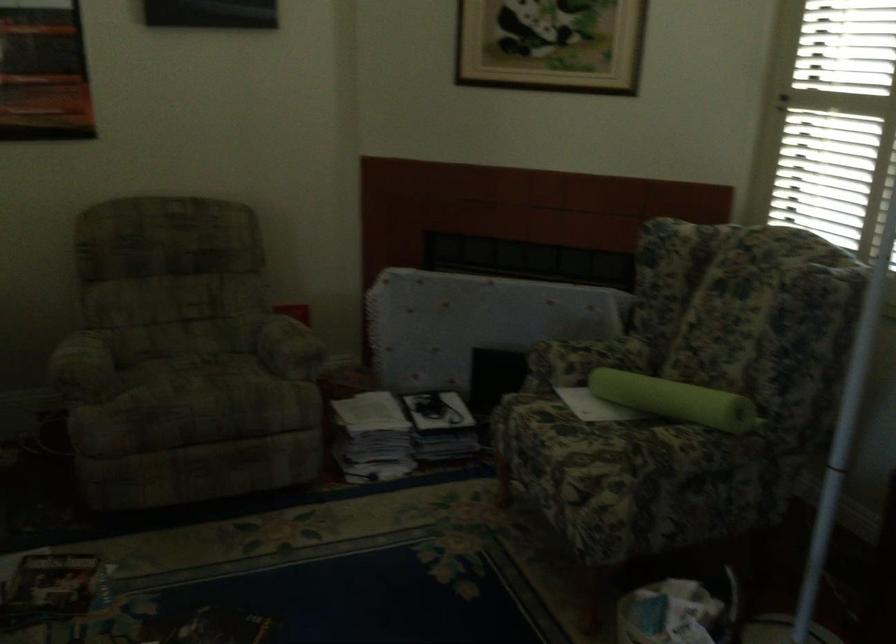
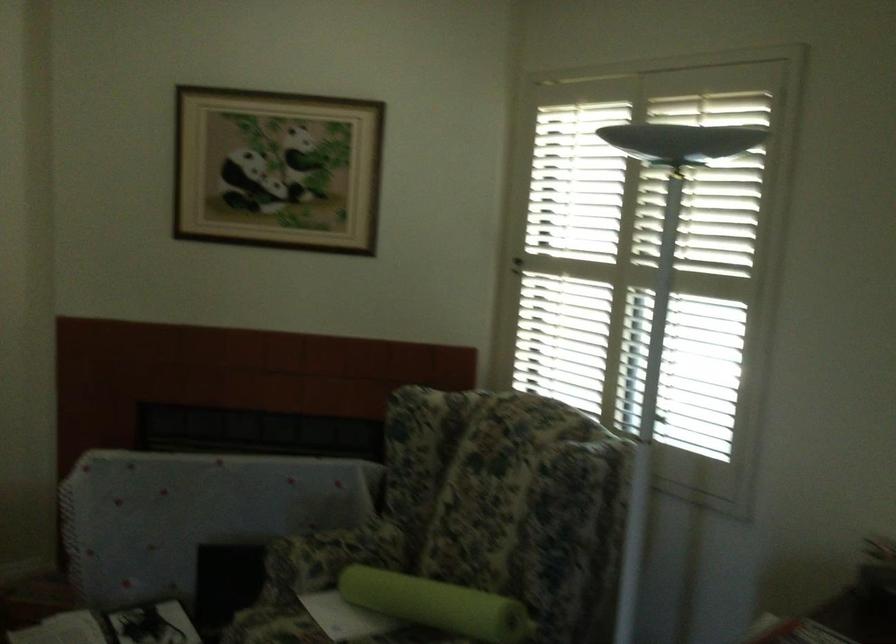
Question: In a continuous first-person perspective shot, in which direction is the camera moving?

Choices:
 (A) Left
 (B) Right
 (C) Forward
 (D) Backward

Answer: (C)